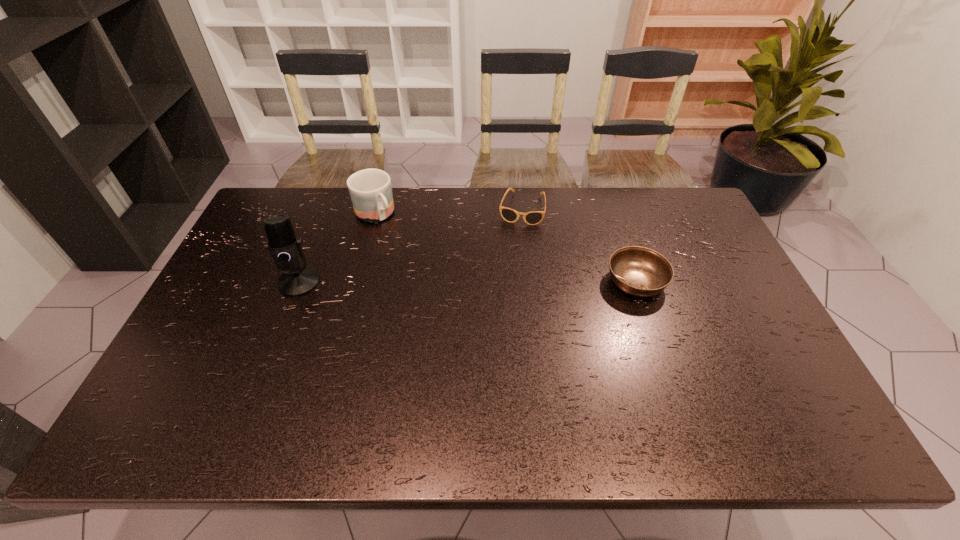
Where is `the leftmost object`? This screenshot has width=960, height=540. the leftmost object is located at coordinates (285, 248).

Identify the location of the tallest object. (285, 248).

Find the location of a particular element. soup bowl is located at coordinates (639, 271).

Identify the location of the third shortest object. (370, 190).

You are a GUI agent. You are given a task and a screenshot of the screen. Output one action in this format:
    pyautogui.click(x=<x>, y=<y>)
    Task: Click on the mug
    The height and width of the screenshot is (540, 960).
    Given the screenshot: What is the action you would take?
    pyautogui.click(x=370, y=190)

Identify the location of sunglasses. The height and width of the screenshot is (540, 960). coord(510,215).

You are a GUI agent. You are given a task and a screenshot of the screen. Output one action in this format:
    pyautogui.click(x=<x>, y=<y>)
    Task: Click on the free space located 0.320m on the stand of the microphone
    
    Given the screenshot: What is the action you would take?
    pyautogui.click(x=252, y=400)

This screenshot has height=540, width=960. What are the coordinates of `free space located 0.190m on the left of the rightmost object` in the screenshot? It's located at (540, 281).

I want to click on vacant space located on the side with the handle of the third object from right to left, so click(x=420, y=268).

I want to click on free spot located 0.230m on the side with the handle of the third object from right to left, so click(420, 267).